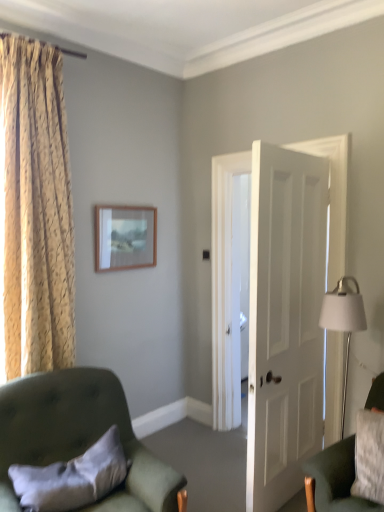
Question: Considering the relative sizes of gold textured curtain at left and wooden picture frame at upper center in the image provided, is gold textured curtain at left bigger than wooden picture frame at upper center?

Choices:
 (A) yes
 (B) no

Answer: (A)

Question: Is gold textured curtain at left behind wooden picture frame at upper center?

Choices:
 (A) yes
 (B) no

Answer: (B)

Question: Is gold textured curtain at left at the right side of wooden picture frame at upper center?

Choices:
 (A) no
 (B) yes

Answer: (A)

Question: Is gold textured curtain at left not within wooden picture frame at upper center?

Choices:
 (A) no
 (B) yes

Answer: (B)

Question: Does gold textured curtain at left have a lesser height compared to wooden picture frame at upper center?

Choices:
 (A) yes
 (B) no

Answer: (B)

Question: From the image's perspective, relative to white soft pillow at lower left, is velvet green armchair at lower left, arranged as the 2th chair when viewed from the right, above or below?

Choices:
 (A) below
 (B) above

Answer: (A)

Question: From their relative heights in the image, would you say velvet green armchair at lower left, arranged as the 2th chair when viewed from the right, is taller or shorter than white soft pillow at lower left?

Choices:
 (A) tall
 (B) short

Answer: (A)

Question: From a real-world perspective, relative to white soft pillow at lower left, is velvet green armchair at lower left, positioned as the 1th chair in left-to-right order, vertically above or below?

Choices:
 (A) below
 (B) above

Answer: (A)

Question: Is velvet green armchair at lower left, positioned as the 1th chair in left-to-right order, spatially inside white soft pillow at lower left, or outside of it?

Choices:
 (A) outside
 (B) inside

Answer: (A)

Question: Is wooden picture frame at upper center taller or shorter than white soft pillow at lower left?

Choices:
 (A) short
 (B) tall

Answer: (B)

Question: Considering the positions of wooden picture frame at upper center and white soft pillow at lower left in the image, is wooden picture frame at upper center bigger or smaller than white soft pillow at lower left?

Choices:
 (A) big
 (B) small

Answer: (B)

Question: From a real-world perspective, is wooden picture frame at upper center physically located above or below white soft pillow at lower left?

Choices:
 (A) above
 (B) below

Answer: (A)

Question: Considering the positions of wooden picture frame at upper center and white soft pillow at lower left in the image, is wooden picture frame at upper center wider or thinner than white soft pillow at lower left?

Choices:
 (A) thin
 (B) wide

Answer: (A)

Question: Choose the correct answer: Is white matte door at center inside velvet green armchair at lower right, the second chair when ordered from left to right, or outside it?

Choices:
 (A) inside
 (B) outside

Answer: (B)

Question: Considering the positions of white matte door at center and velvet green armchair at lower right, the second chair when ordered from left to right, in the image, is white matte door at center bigger or smaller than velvet green armchair at lower right, the second chair when ordered from left to right,?

Choices:
 (A) big
 (B) small

Answer: (A)